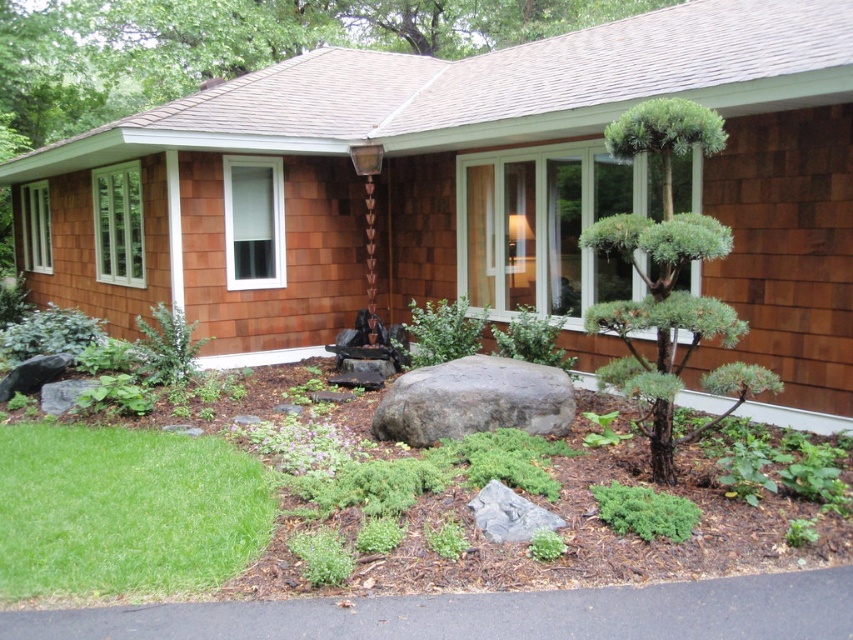
You are a gardener standing at the edge of the green grass at lower left, and you need to reach the gray rough boulder at center to place some decorative stones. Considering your average step length is 2.2 feet, how many steps will it take you to walk directly to the boulder?

The distance between the green grass at lower left and the gray rough boulder at center is 4.40 feet. Since each step covers 2.2 feet, dividing the total distance by the step length gives 4.40 divided by 2.2 equals 2 steps. Therefore, it will take exactly 2 steps to reach the boulder.